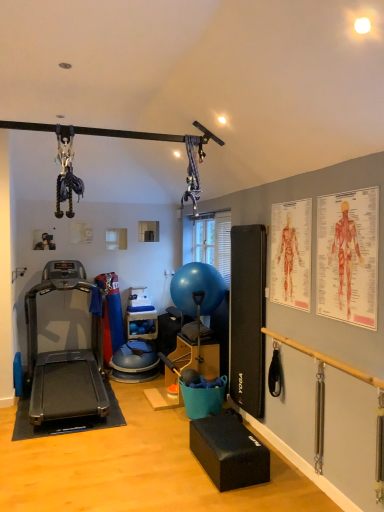
Question: From the image's perspective, would you say wooden bar at right is positioned over metallic silver photo frame at upper left, acting as the second person starting from the right?

Choices:
 (A) yes
 (B) no

Answer: (B)

Question: From a real-world perspective, is wooden bar at right positioned under metallic silver photo frame at upper left, which appears as the 2th person when viewed from the front, based on gravity?

Choices:
 (A) yes
 (B) no

Answer: (A)

Question: Can we say wooden bar at right lies outside metallic silver photo frame at upper left, acting as the second person starting from the right?

Choices:
 (A) yes
 (B) no

Answer: (A)

Question: Can you confirm if wooden bar at right is positioned to the right of metallic silver photo frame at upper left, acting as the second person starting from the right?

Choices:
 (A) no
 (B) yes

Answer: (B)

Question: Is wooden bar at right facing away from metallic silver photo frame at upper left, the first person in the back-to-front sequence?

Choices:
 (A) no
 (B) yes

Answer: (A)

Question: Is wooden bar at right beside metallic silver photo frame at upper left, the first person in the back-to-front sequence?

Choices:
 (A) no
 (B) yes

Answer: (A)

Question: Does blue rubber shelf at center have a greater height compared to red paper human anatomy chart at upper right?

Choices:
 (A) no
 (B) yes

Answer: (A)

Question: From the image's perspective, is blue rubber shelf at center located above red paper human anatomy chart at upper right?

Choices:
 (A) no
 (B) yes

Answer: (A)

Question: Considering the relative sizes of blue rubber shelf at center and red paper human anatomy chart at upper right in the image provided, is blue rubber shelf at center thinner than red paper human anatomy chart at upper right?

Choices:
 (A) no
 (B) yes

Answer: (A)

Question: Does blue rubber shelf at center have a greater width compared to red paper human anatomy chart at upper right?

Choices:
 (A) yes
 (B) no

Answer: (A)

Question: Is blue rubber shelf at center further to the viewer compared to red paper human anatomy chart at upper right?

Choices:
 (A) yes
 (B) no

Answer: (A)

Question: Is blue rubber shelf at center in contact with red paper human anatomy chart at upper right?

Choices:
 (A) no
 (B) yes

Answer: (A)

Question: Is anatomical chart at upper right, the second person positioned from the left, surrounded by blue rubber shelf at center?

Choices:
 (A) no
 (B) yes

Answer: (A)